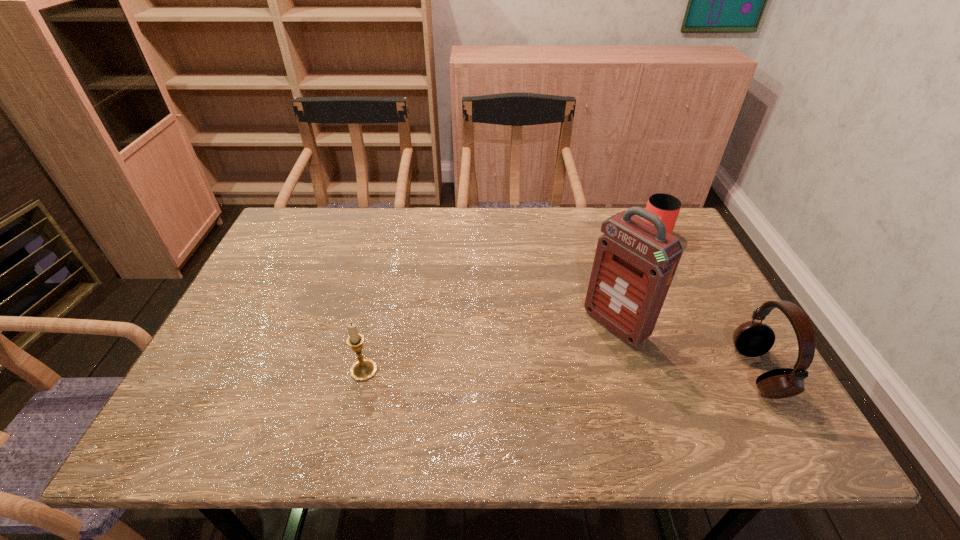
The image size is (960, 540). In order to click on vacant point located between the tallest object and the leftmost object in this screenshot , I will do `click(490, 348)`.

Find the location of a particular element. vacant space that is in between the headset and the cup is located at coordinates (708, 305).

I want to click on vacant space in between the candle holder and the first-aid kit, so click(x=490, y=348).

Locate an element on the screen. The height and width of the screenshot is (540, 960). vacant space in between the headset and the farthest object is located at coordinates (708, 305).

This screenshot has width=960, height=540. In order to click on free space between the leftmost object and the farthest object in this screenshot , I will do 510,303.

At what (x,y) coordinates should I click in order to perform the action: click on vacant point located between the farthest object and the candle holder. Please return your answer as a coordinate pair (x, y). The image size is (960, 540). Looking at the image, I should click on (510, 303).

The image size is (960, 540). What are the coordinates of `empty location between the shortest object and the leftmost object` in the screenshot? It's located at (510, 303).

Image resolution: width=960 pixels, height=540 pixels. Identify the location of free point between the headset and the first-aid kit. (686, 349).

In order to click on object that is the third closest to the cup in this screenshot , I will do `click(364, 369)`.

This screenshot has height=540, width=960. I want to click on object that stands as the closest to the tallest object, so click(752, 339).